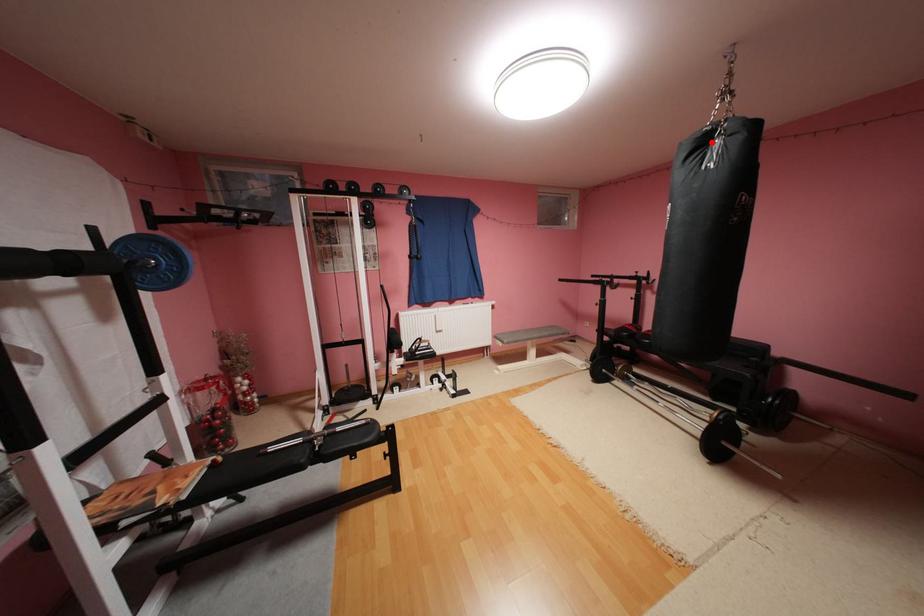
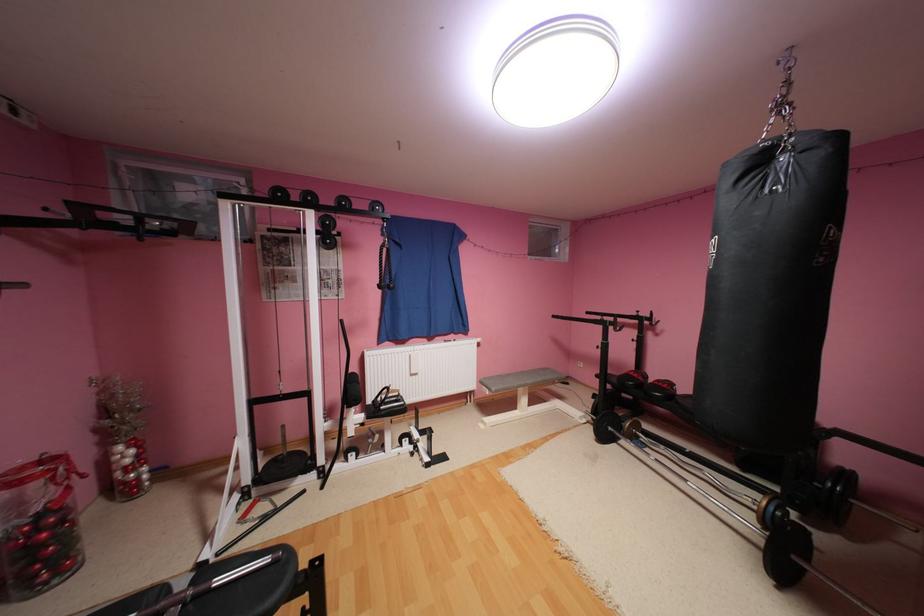
Locate, in the second image, the point that corresponds to the highlighted location in the first image.

(769, 161)